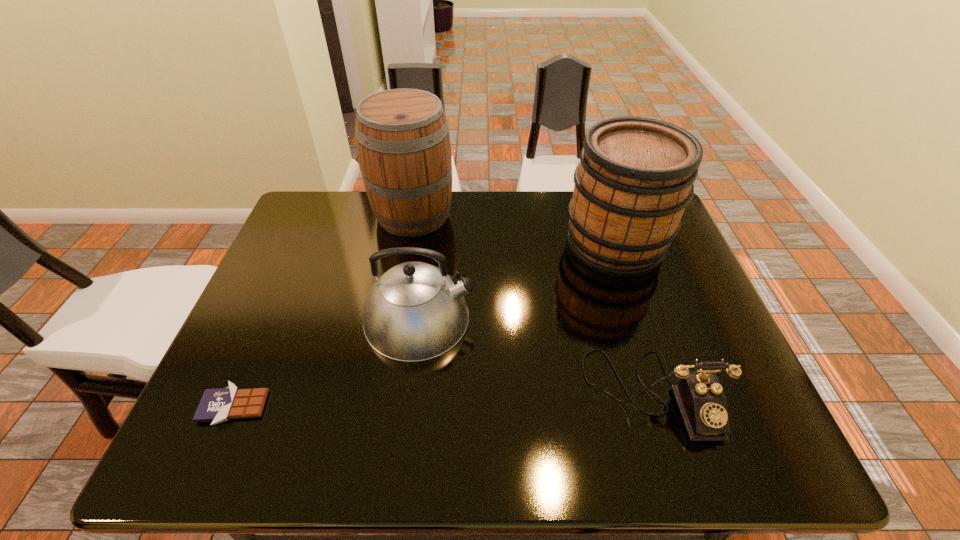
Find the location of `vacant space at the left edge of the desktop`. vacant space at the left edge of the desktop is located at coordinates (252, 314).

You are a GUI agent. You are given a task and a screenshot of the screen. Output one action in this format:
    pyautogui.click(x=<x>, y=<y>)
    Task: Click on the vacant space at the right edge of the desktop
    This screenshot has width=960, height=540.
    Given the screenshot: What is the action you would take?
    pyautogui.click(x=681, y=297)

Where is `vacant area at the far left corner of the desktop`? vacant area at the far left corner of the desktop is located at coordinates (324, 213).

In order to click on free space at the near right corner in this screenshot , I will do `click(739, 461)`.

Identify the location of free point between the chocolate bar and the left cider. The image size is (960, 540). (324, 310).

You are a GUI agent. You are given a task and a screenshot of the screen. Output one action in this format:
    pyautogui.click(x=<x>, y=<y>)
    Task: Click on the vacant region between the left cider and the right cider
    
    Given the screenshot: What is the action you would take?
    pyautogui.click(x=515, y=230)

Find the location of a particular element. free space between the left cider and the right cider is located at coordinates (515, 230).

Find the location of `unoccupied area between the telephone and the right cider`. unoccupied area between the telephone and the right cider is located at coordinates (634, 319).

Find the location of `free spot between the right cider and the left cider`. free spot between the right cider and the left cider is located at coordinates (515, 230).

Find the location of a particular element. This screenshot has height=540, width=960. free space between the third tallest object and the leftmost object is located at coordinates (326, 363).